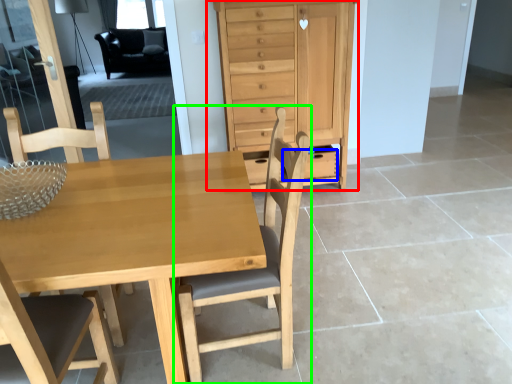
Question: Estimate the real-world distances between objects in this image. Which object is closer to chest of drawers (highlighted by a red box), drawer (highlighted by a blue box) or chair (highlighted by a green box)?

Choices:
 (A) drawer
 (B) chair

Answer: (A)